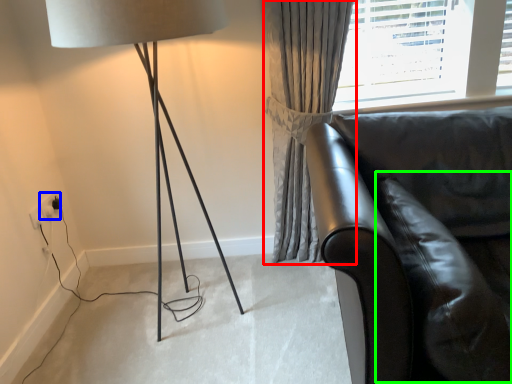
Question: Estimate the real-world distances between objects in this image. Which object is closer to curtain (highlighted by a red box), electric outlet (highlighted by a blue box) or swivel chair (highlighted by a green box)?

Choices:
 (A) electric outlet
 (B) swivel chair

Answer: (B)